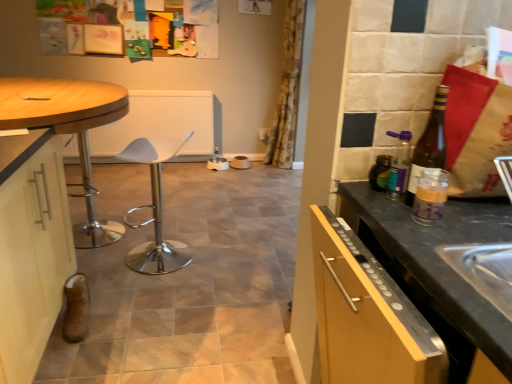
Describe the element at coordinates (154, 214) in the screenshot. The height and width of the screenshot is (384, 512). I see `white plastic bar stool at center` at that location.

Measure the distance between wooden polished table at left and camera.

The depth of wooden polished table at left is 1.57 meters.

Locate an element on the screen. The image size is (512, 384). white plastic bar stool at center is located at coordinates (154, 214).

Does translucent plastic jar at right, which ranks as the 1th bottle in front-to-back order, appear on the left side of green glass bottle at right, which appears as the third bottle when viewed from the front?

Incorrect, translucent plastic jar at right, which ranks as the 1th bottle in front-to-back order, is not on the left side of green glass bottle at right, which appears as the third bottle when viewed from the front.

Could you measure the distance between translucent plastic jar at right, the 3th bottle from the back, and green glass bottle at right, marked as the first bottle in a back-to-front arrangement?

translucent plastic jar at right, the 3th bottle from the back, and green glass bottle at right, marked as the first bottle in a back-to-front arrangement, are 6.17 inches apart from each other.

Looking at this image, are translucent plastic jar at right, which ranks as the 1th bottle in front-to-back order, and green glass bottle at right, which appears as the third bottle when viewed from the front, located far from each other?

No, translucent plastic jar at right, which ranks as the 1th bottle in front-to-back order, is in close proximity to green glass bottle at right, which appears as the third bottle when viewed from the front.

Looking at this image, does floral fabric curtain at center turn towards green glass bottle at right, which appears as the third bottle when viewed from the front?

No.

Between floral fabric curtain at center and green glass bottle at right, marked as the first bottle in a back-to-front arrangement, which one has more height?

floral fabric curtain at center.

Would you consider floral fabric curtain at center to be distant from green glass bottle at right, which appears as the third bottle when viewed from the front?

Yes.

Between floral fabric curtain at center and green glass bottle at right, marked as the first bottle in a back-to-front arrangement, which one has smaller size?

green glass bottle at right, marked as the first bottle in a back-to-front arrangement, is smaller.

From the image's perspective, count 1st bottles upward from the white plastic bar stool at center and point to it. Please provide its 2D coordinates.

[(430, 197)]

Considering the sizes of objects translucent plastic jar at right, which ranks as the 1th bottle in front-to-back order, and white plastic bar stool at center in the image provided, who is wider, translucent plastic jar at right, which ranks as the 1th bottle in front-to-back order, or white plastic bar stool at center?

white plastic bar stool at center.

How different are the orientations of translucent plastic jar at right, which ranks as the 1th bottle in front-to-back order, and white plastic bar stool at center in degrees?

translucent plastic jar at right, which ranks as the 1th bottle in front-to-back order, and white plastic bar stool at center are facing 15.2 degrees away from each other.

Does point (424, 203) come in front of point (140, 245)?

Yes, point (424, 203) is in front of point (140, 245).

Considering the points (6, 123) and (62, 186), which point is in front, point (6, 123) or point (62, 186)?

Positioned in front is point (6, 123).

Does wooden polished table at left contain matte white cabinet at left?

No, wooden polished table at left does not contain matte white cabinet at left.

From the image's perspective, is wooden polished table at left located beneath matte white cabinet at left?

No, from the image's perspective, wooden polished table at left is not below matte white cabinet at left.

Is wooden polished table at left far from matte white cabinet at left?

That's not correct — wooden polished table at left is a little close to matte white cabinet at left.

Would you say white plastic bar stool at center is outside translucent plastic jar at right, which ranks as the 1th bottle in front-to-back order?

white plastic bar stool at center lies outside translucent plastic jar at right, which ranks as the 1th bottle in front-to-back order,'s area.

Is white plastic bar stool at center not near translucent plastic jar at right, which ranks as the 1th bottle in front-to-back order?

Yes, white plastic bar stool at center is far from translucent plastic jar at right, which ranks as the 1th bottle in front-to-back order.

Which object is closer to the camera taking this photo, white plastic bar stool at center or translucent plastic jar at right, the 3th bottle from the back?

Positioned in front is translucent plastic jar at right, the 3th bottle from the back.

Can you confirm if white plastic bar stool at center is smaller than translucent plastic jar at right, which ranks as the 1th bottle in front-to-back order?

Incorrect, white plastic bar stool at center is not smaller in size than translucent plastic jar at right, which ranks as the 1th bottle in front-to-back order.

Would you say matte white cabinet at left is outside translucent glass bottle at right, acting as the 2th bottle starting from the front?

matte white cabinet at left lies outside translucent glass bottle at right, acting as the 2th bottle starting from the front,'s area.

Consider the image. From the image's perspective, who appears lower, matte white cabinet at left or translucent glass bottle at right, acting as the 2th bottle starting from the front?

matte white cabinet at left is shown below in the image.

Does matte white cabinet at left have a greater height compared to translucent glass bottle at right, acting as the 2th bottle starting from the front?

Yes.

Would you consider floral fabric curtain at center to be distant from matte white cabinet at left?

Indeed, floral fabric curtain at center is not near matte white cabinet at left.

Which object is more forward, floral fabric curtain at center or matte white cabinet at left?

matte white cabinet at left.

Between floral fabric curtain at center and matte white cabinet at left, which one appears on the right side from the viewer's perspective?

Positioned to the right is floral fabric curtain at center.

Find the location of a particular element. the 1st bottle located above the green glass bottle at right, which appears as the third bottle when viewed from the front (from a real-world perspective) is located at coordinates (430, 197).

Find the location of `curtain below the green glass bottle at right, which appears as the third bottle when viewed from the front (from a real-world perspective)`. curtain below the green glass bottle at right, which appears as the third bottle when viewed from the front (from a real-world perspective) is located at coordinates (287, 90).

Which object lies nearer to the anchor point wooden polished table at left, green glass bottle at right, which appears as the third bottle when viewed from the front, or translucent glass bottle at right, acting as the 2th bottle starting from the front?

green glass bottle at right, which appears as the third bottle when viewed from the front, is closer to wooden polished table at left.

Based on their spatial positions, is translucent plastic jar at right, which ranks as the 1th bottle in front-to-back order, or wooden polished table at left further from green glass bottle at right, which appears as the third bottle when viewed from the front?

wooden polished table at left lies further to green glass bottle at right, which appears as the third bottle when viewed from the front, than the other object.

When comparing their distances from translucent plastic jar at right, the 3th bottle from the back, does floral fabric curtain at center or green glass bottle at right, which appears as the third bottle when viewed from the front, seem closer?

Based on the image, green glass bottle at right, which appears as the third bottle when viewed from the front, appears to be nearer to translucent plastic jar at right, the 3th bottle from the back.

Based on their spatial positions, is translucent plastic jar at right, the 3th bottle from the back, or matte white cabinet at left closer to floral fabric curtain at center?

Among the two, matte white cabinet at left is located nearer to floral fabric curtain at center.

Which object lies further to the anchor point green glass bottle at right, marked as the first bottle in a back-to-front arrangement, floral fabric curtain at center or wooden polished table at left?

floral fabric curtain at center is further to green glass bottle at right, marked as the first bottle in a back-to-front arrangement.

Looking at the image, which one is located further to translucent plastic jar at right, which ranks as the 1th bottle in front-to-back order, white plastic bar stool at center or translucent glass bottle at right, acting as the 2th bottle starting from the back?

white plastic bar stool at center is positioned further to the anchor translucent plastic jar at right, which ranks as the 1th bottle in front-to-back order.

Estimate the real-world distances between objects in this image. Which object is closer to white plastic bar stool at center, translucent glass bottle at right, acting as the 2th bottle starting from the front, or green glass bottle at right, which appears as the third bottle when viewed from the front?

green glass bottle at right, which appears as the third bottle when viewed from the front.

Estimate the real-world distances between objects in this image. Which object is closer to green glass bottle at right, marked as the first bottle in a back-to-front arrangement, white plastic bar stool at center or matte white cabinet at left?

Based on the image, matte white cabinet at left appears to be nearer to green glass bottle at right, marked as the first bottle in a back-to-front arrangement.

Find the location of a particular element. This screenshot has height=384, width=512. bar stool located between wooden polished table at left and translucent plastic jar at right, which ranks as the 1th bottle in front-to-back order, in the left-right direction is located at coordinates (154, 214).

This screenshot has width=512, height=384. Find the location of `cabinetry located between wooden polished table at left and translucent glass bottle at right, acting as the 2th bottle starting from the back, in the left-right direction`. cabinetry located between wooden polished table at left and translucent glass bottle at right, acting as the 2th bottle starting from the back, in the left-right direction is located at coordinates (31, 249).

At what (x,y) coordinates should I click in order to perform the action: click on bottle between translucent glass bottle at right, acting as the 2th bottle starting from the back, and floral fabric curtain at center from front to back. Please return your answer as a coordinate pair (x, y). Looking at the image, I should click on (380, 173).

Locate an element on the screen. bar stool positioned between matte white cabinet at left and floral fabric curtain at center from near to far is located at coordinates (154, 214).